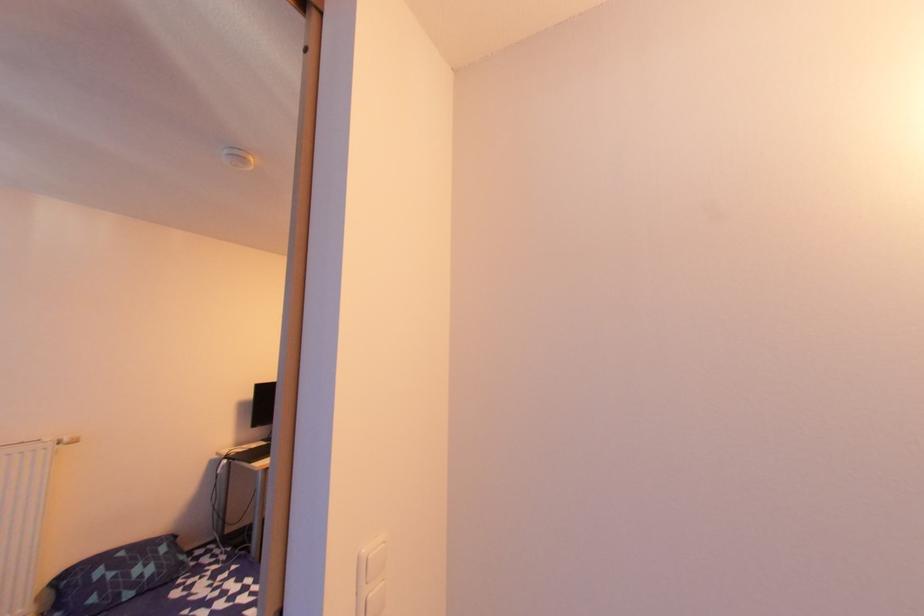
Find where to press the white light switch. Please return your answer as a coordinate pair (x, y).

(371, 578)